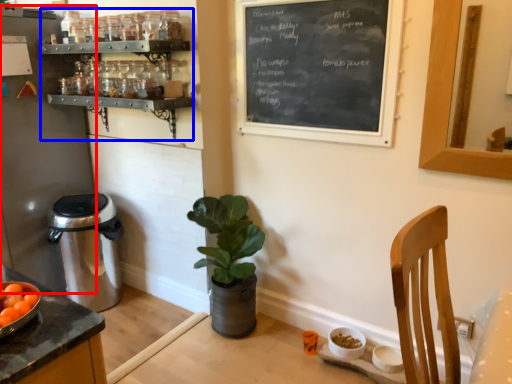
Question: Which point is closer to the camera, appliance (highlighted by a red box) or shelf (highlighted by a blue box)?

Choices:
 (A) appliance
 (B) shelf

Answer: (B)